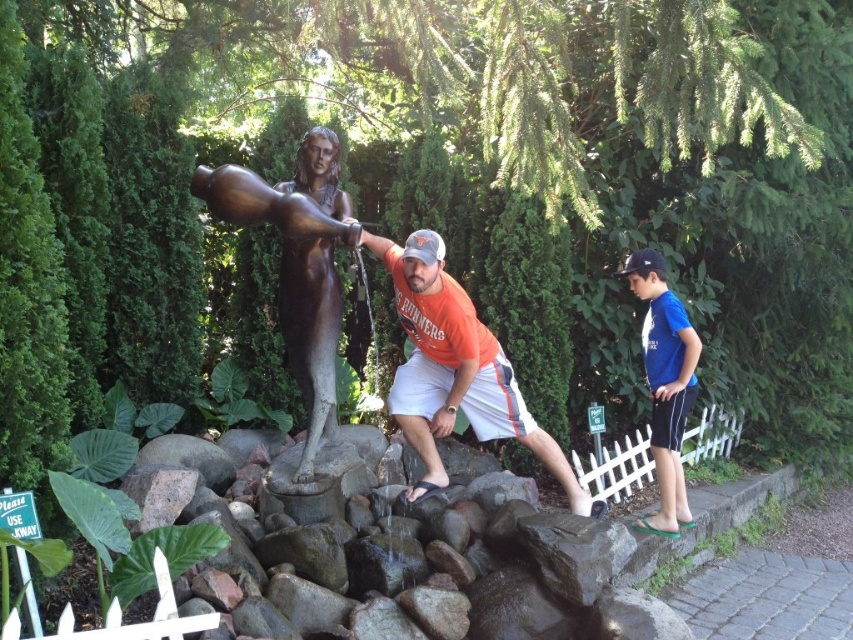
Question: Is bronze statue at center to the left of blue fabric shorts at right from the viewer's perspective?

Choices:
 (A) no
 (B) yes

Answer: (B)

Question: From the image, what is the correct spatial relationship of matte bronze statue at center in relation to blue fabric shorts at right?

Choices:
 (A) right
 (B) left

Answer: (B)

Question: Estimate the real-world distances between objects in this image. Which object is farther from the blue fabric shorts at right?

Choices:
 (A) matte bronze statue at center
 (B) bronze statue at center

Answer: (B)

Question: Which point is closer to the camera?

Choices:
 (A) (660, 339)
 (B) (421, 376)

Answer: (B)

Question: Can you confirm if bronze statue at center is positioned above blue fabric shorts at right?

Choices:
 (A) no
 (B) yes

Answer: (B)

Question: Estimate the real-world distances between objects in this image. Which object is farther from the blue fabric shorts at right?

Choices:
 (A) matte bronze statue at center
 (B) bronze statue at center

Answer: (B)